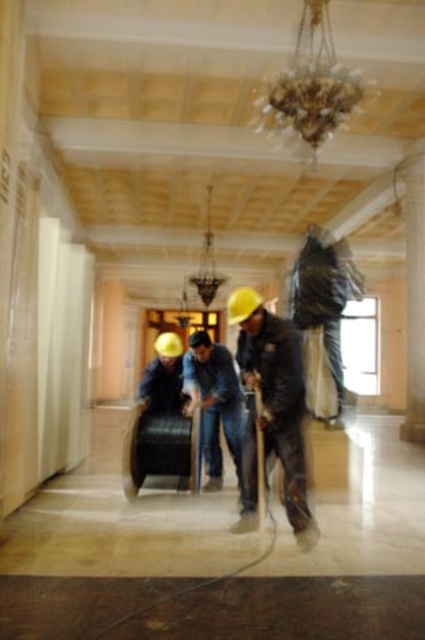
You are standing in the grand building and notice two items at the center of the scene. The matte black jacket at center and the blue jeans at center. Which one is positioned closer to you?

The matte black jacket at center is closer to the viewer than the blue jeans at center.

You are an observer standing in the grand building. You see the matte black jacket at center and the blue jeans at center. Which one is higher?

The matte black jacket at center is above the blue jeans at center, so the matte black jacket at center is higher.

You are a contractor standing at the entrance of the building and need to locate the matte black jacket at center. According to the coordinates provided, where should you look relative to your position?

The matte black jacket at center is located at coordinates point (272, 410), which means it is positioned to your right and slightly ahead of you based on standard coordinate systems where the origin is at the bottom left corner.